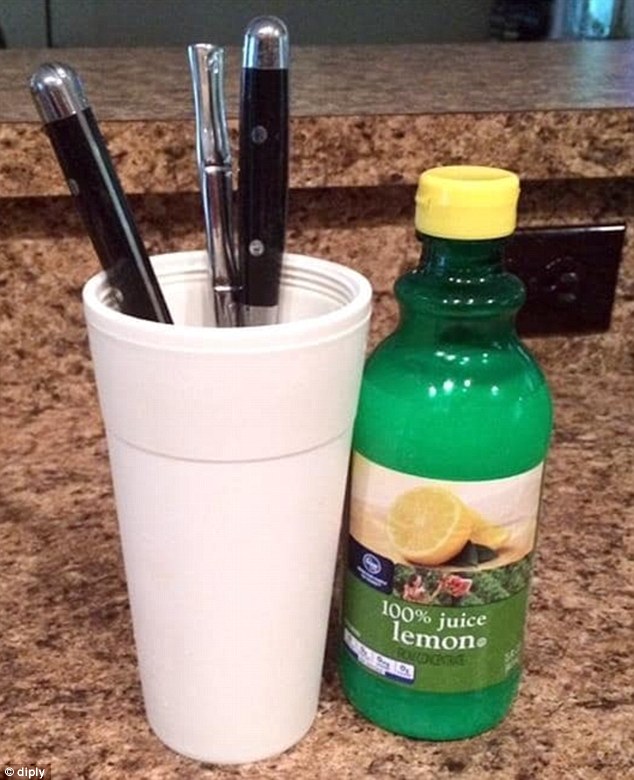
In order to click on bartop in this screenshot , I will do `click(403, 105)`.